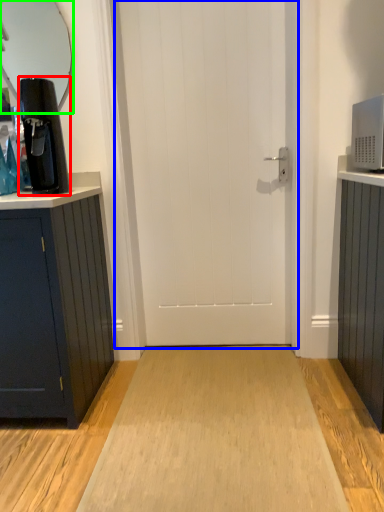
Question: Estimate the real-world distances between objects in this image. Which object is closer to coffee machine (highlighted by a red box), door (highlighted by a blue box) or mirror (highlighted by a green box)?

Choices:
 (A) door
 (B) mirror

Answer: (A)